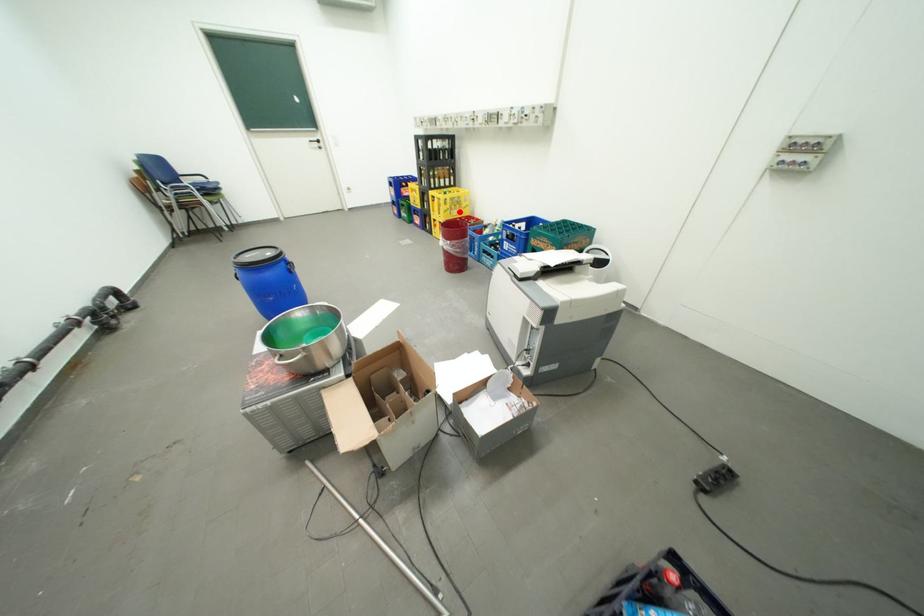
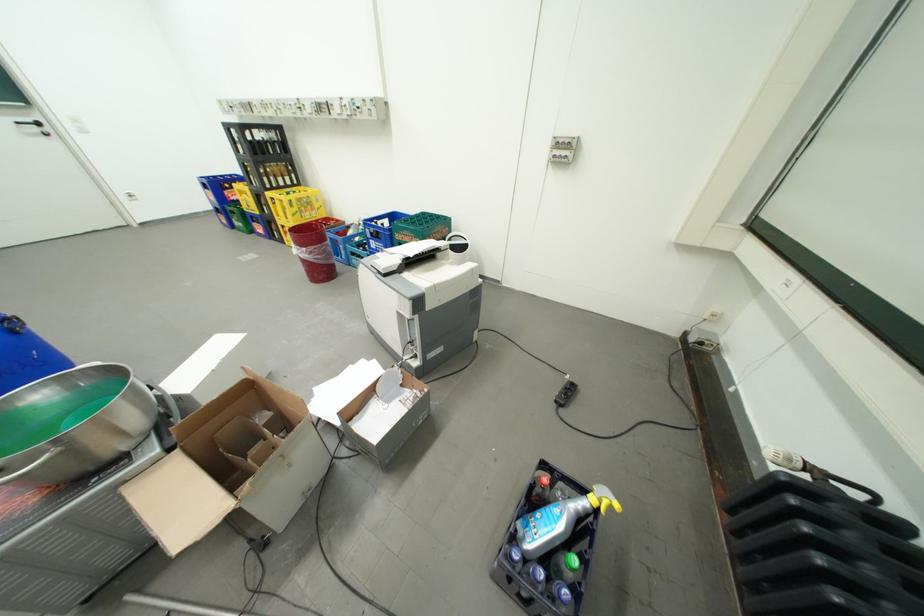
Question: A red point is marked in image1. In image2, is the corresponding 3D point closer to the camera or farther? Reply with the corresponding letter.

Choices:
 (A) The corresponding 3D point is closer.
 (B) The corresponding 3D point is farther.

Answer: (A)